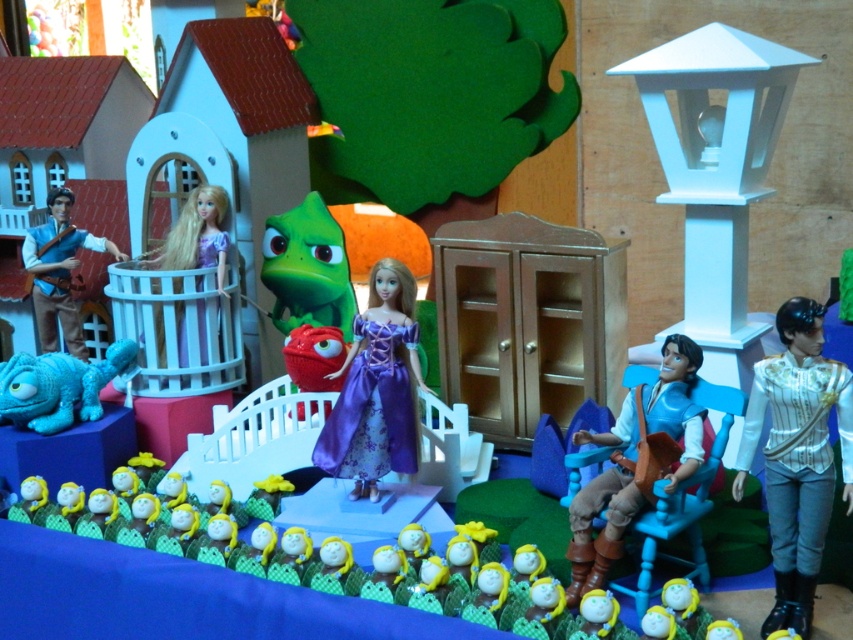
Question: Is white satin shirt at right below brown leather vest at center right?

Choices:
 (A) no
 (B) yes

Answer: (A)

Question: Among these points, which one is farthest from the camera?

Choices:
 (A) (218, 291)
 (B) (334, 406)
 (C) (15, 400)

Answer: (A)

Question: Is blue plush chameleon at lower left below matte purple dress at center?

Choices:
 (A) no
 (B) yes

Answer: (B)

Question: Estimate the real-world distances between objects in this image. Which object is closer to the brown leather vest at center right?

Choices:
 (A) matte brown leather jacket at left
 (B) blue plush chameleon at lower left

Answer: (B)

Question: Based on their relative distances, which object is nearer to the white satin shirt at right?

Choices:
 (A) blue plush chameleon at lower left
 (B) brown leather vest at center right
 (C) purple satin dress at center

Answer: (B)

Question: Does purple satin dress at center appear under blue plush chameleon at lower left?

Choices:
 (A) yes
 (B) no

Answer: (B)